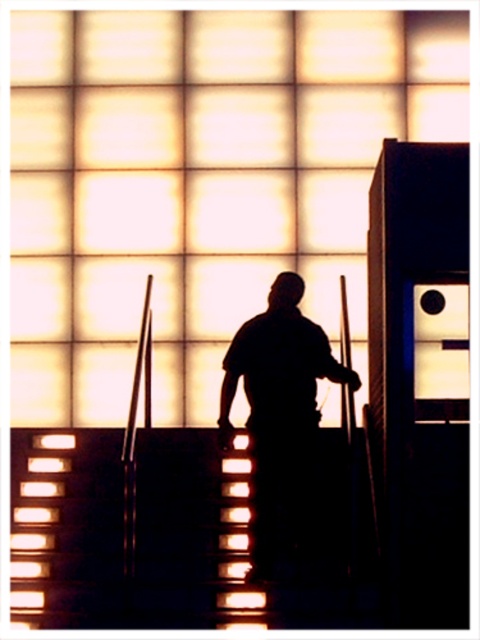
Looking at this image, you are a security guard monitoring the entrance. You notice the black matte figure at center and the metallic stairwell at center in the surveillance footage. Which object is closer to the camera?

The black matte figure at center is closer to the camera because the metallic stairwell at center is behind it.

You are a security camera monitoring the staircase area. The system requires you to report the exact coordinates of the black matte figure at center. What are its coordinates?

The coordinates of the black matte figure at center are at point (278, 410).

In the scene shown: You are standing at the bottom of the staircase in the image. The black matte figure at center is at point (278,410). If you want to reach the black matte figure at center, which direction should you move towards?

The black matte figure at center is located at point (278,410), so you should move towards the center of the staircase to reach it.